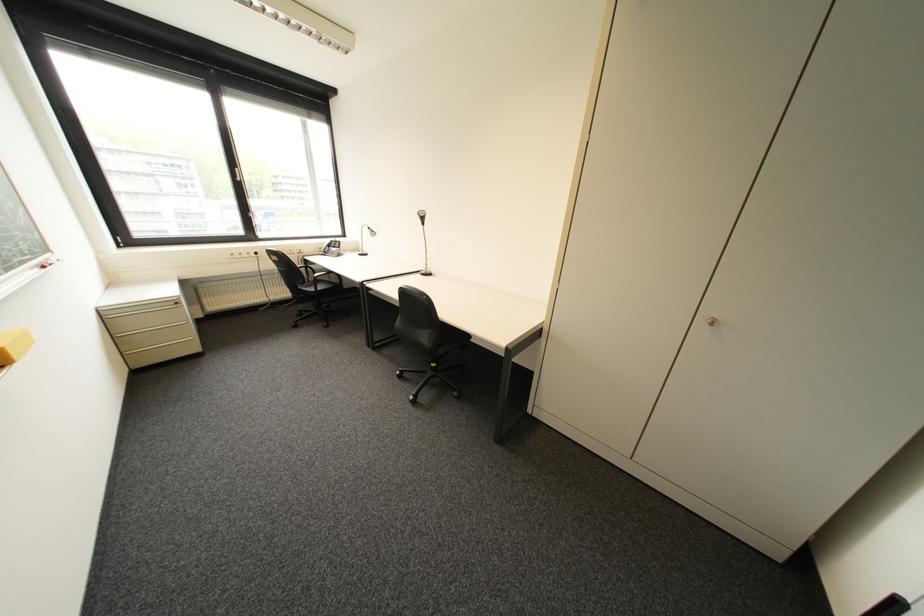
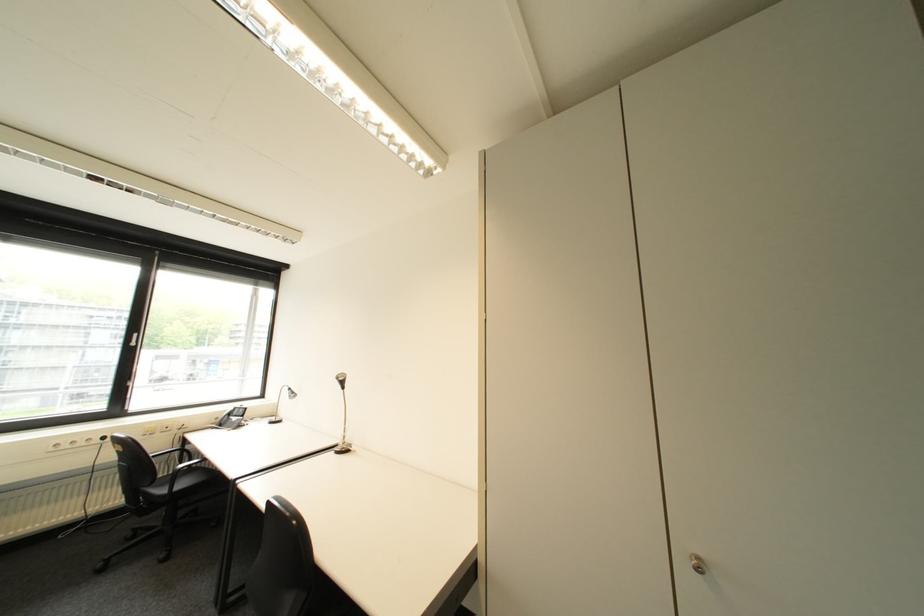
The point at (432,273) is marked in the first image. Where is the corresponding point in the second image?

(346, 450)